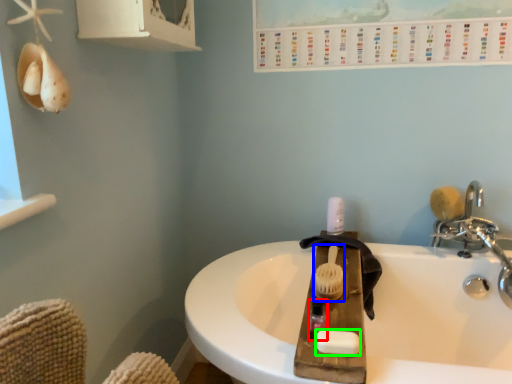
Question: Which object is positioned closest to mouthwash (highlighted by a red box)? Select from brush (highlighted by a blue box) and soap (highlighted by a green box).

Choices:
 (A) brush
 (B) soap

Answer: (B)